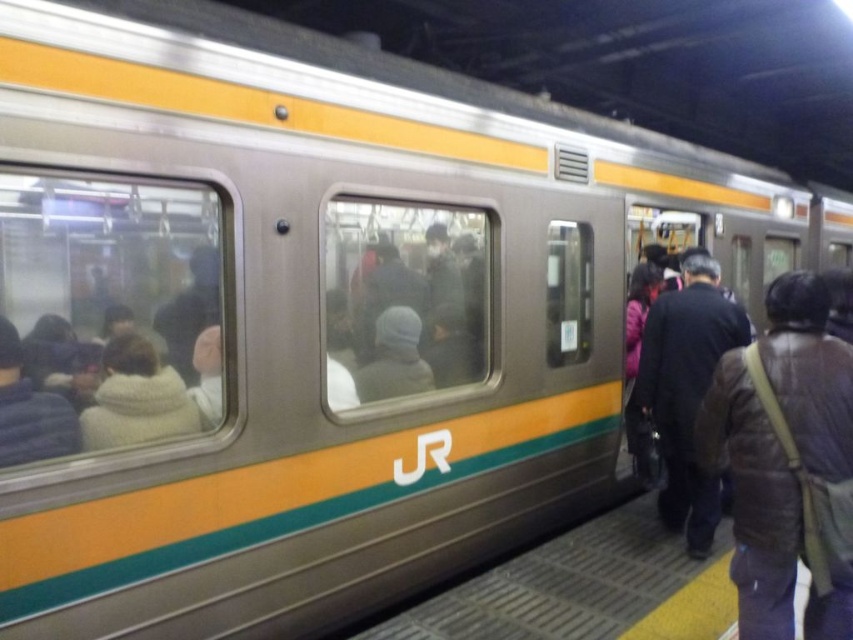
From the picture: Does brown leather jacket at lower right come behind dark brown leather jacket at right?

No, brown leather jacket at lower right is closer to the viewer.

Is brown leather jacket at lower right bigger than dark brown leather jacket at right?

No, brown leather jacket at lower right is not bigger than dark brown leather jacket at right.

Which is behind, point (799, 381) or point (698, 364)?

Point (698, 364)

Where is `brown leather jacket at lower right`? Image resolution: width=853 pixels, height=640 pixels. brown leather jacket at lower right is located at coordinates (753, 497).